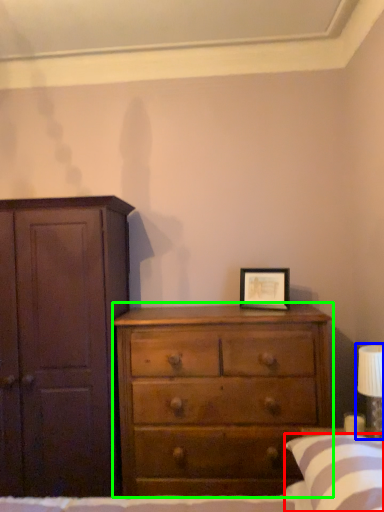
Question: Which is farther away from pillow (highlighted by a red box)? bedside lamp (highlighted by a blue box) or chest of drawers (highlighted by a green box)?

Choices:
 (A) bedside lamp
 (B) chest of drawers

Answer: (B)